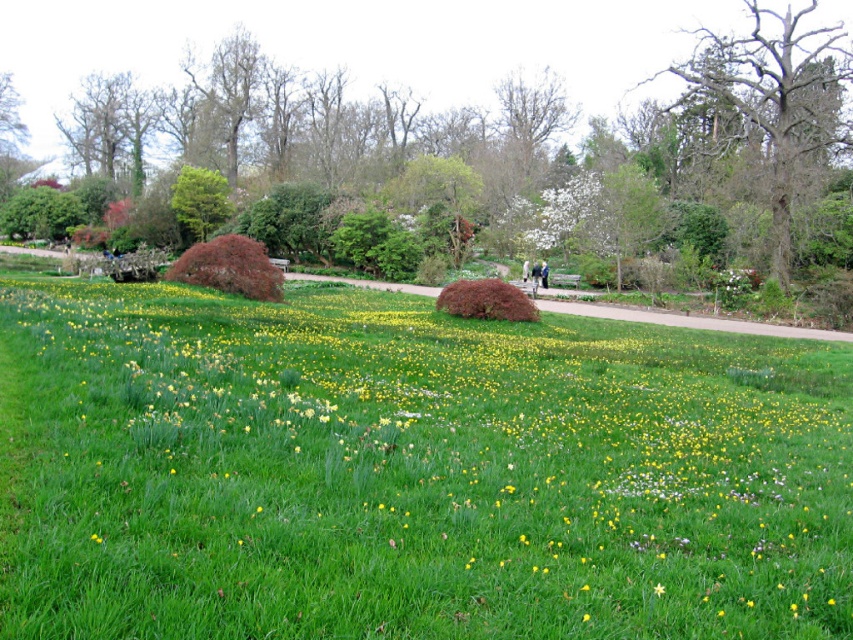
Is green leafy bush at left above dark blue jacket at center?

Correct, green leafy bush at left is located above dark blue jacket at center.

Is green leafy bush at left positioned at the back of dark blue jacket at center?

Yes, green leafy bush at left is further from the viewer.

Which is in front, point (57, 220) or point (544, 269)?

Point (544, 269) is in front.

The width and height of the screenshot is (853, 640). Find the location of `green leafy bush at left`. green leafy bush at left is located at coordinates (39, 212).

Is shiny reddish-brown bush at center-left shorter than smooth bark tree at upper center?

Yes.

The image size is (853, 640). Identify the location of shiny reddish-brown bush at center-left. (229, 268).

You are a GUI agent. You are given a task and a screenshot of the screen. Output one action in this format:
    pyautogui.click(x=<x>, y=<y>)
    Task: Click on the shiny reddish-brown bush at center-left
    
    Given the screenshot: What is the action you would take?
    pyautogui.click(x=229, y=268)

Which is more to the right, dark blue jacket at center or light pink fabric at center?

dark blue jacket at center

Measure the distance between dark blue jacket at center and light pink fabric at center.

A distance of 1.30 meters exists between dark blue jacket at center and light pink fabric at center.

Identify the location of dark blue jacket at center. This screenshot has width=853, height=640. (544, 273).